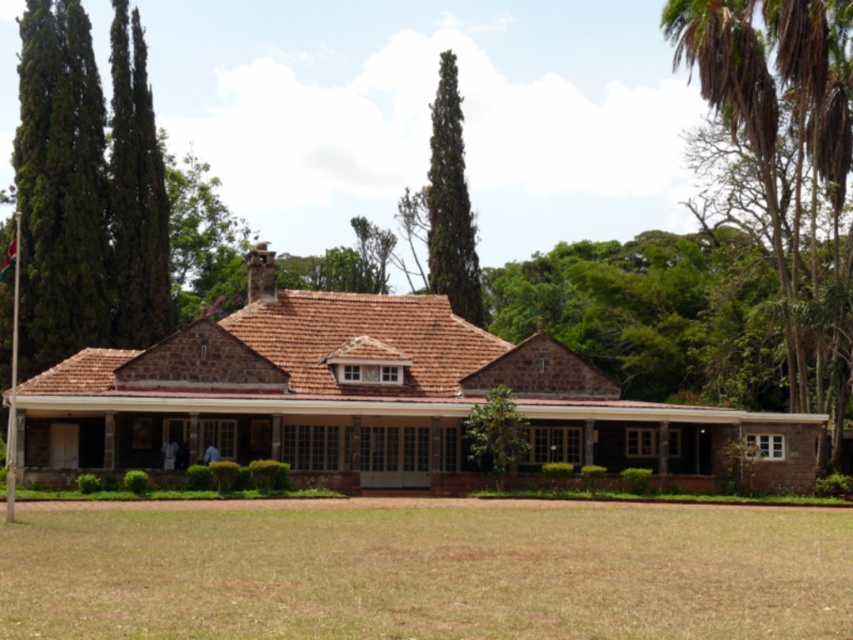
You are standing in front of the building and want to walk from the brown grass at lower center to the green textured cypress at upper center. Which direction should you move relative to the cypress?

You should move to the left side of the green textured cypress at upper center because the brown grass at lower center is positioned on the left side of it.

You are standing in front of the building and notice the brown grass at lower center and the green textured cypress at upper center. Which of these two objects is taller?

The green textured cypress at upper center is taller than the brown grass at lower center.

From the picture: You are standing in front of the building and want to determine which object is taller between the green textured cypress at upper center and the metallic flag pole at left. Based on the scene, which one is taller?

The green textured cypress at upper center is taller than the metallic flag pole at left.